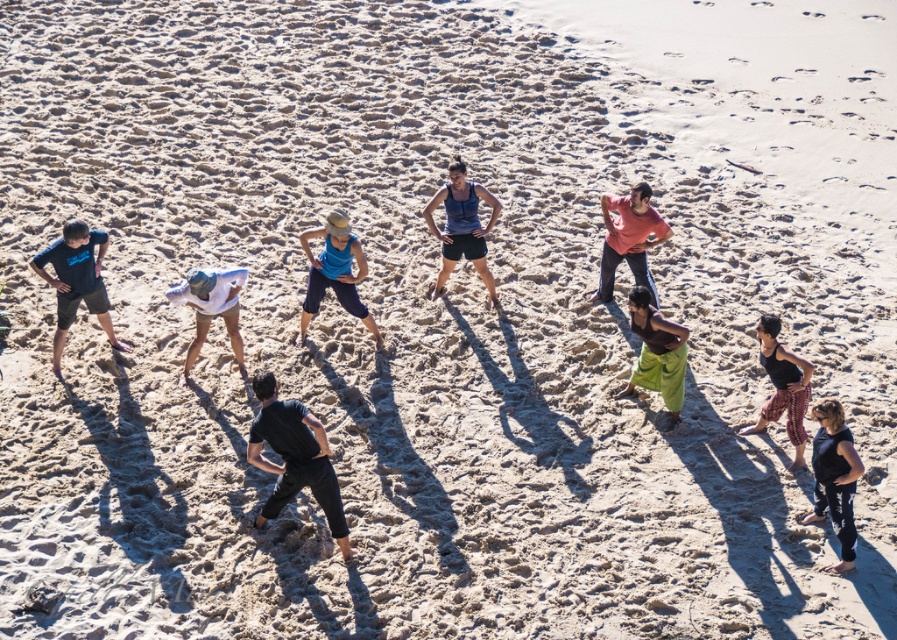
Does matte black shorts at left appear over blue fabric shorts at center?

No.

Who is higher up, matte black shorts at left or blue fabric shorts at center?

Positioned higher is blue fabric shorts at center.

Describe the element at coordinates (76, 282) in the screenshot. This screenshot has width=897, height=640. I see `matte black shorts at left` at that location.

The height and width of the screenshot is (640, 897). Identify the location of matte black shorts at left. (76, 282).

Which of these two, matte black shorts at left or green cotton pants at center, stands shorter?

With less height is green cotton pants at center.

Image resolution: width=897 pixels, height=640 pixels. What do you see at coordinates (76, 282) in the screenshot? I see `matte black shorts at left` at bounding box center [76, 282].

What do you see at coordinates (76, 282) in the screenshot? Image resolution: width=897 pixels, height=640 pixels. I see `matte black shorts at left` at bounding box center [76, 282].

Find the location of a particular element. The image size is (897, 640). matte black shorts at left is located at coordinates (76, 282).

Between point (253, 452) and point (436, 284), which one is positioned in front?

Point (253, 452) is in front.

Who is more distant from viewer, (260, 508) or (492, 296)?

The point (492, 296) is behind.

Image resolution: width=897 pixels, height=640 pixels. In order to click on black matte shirt at center in this screenshot , I will do `click(294, 458)`.